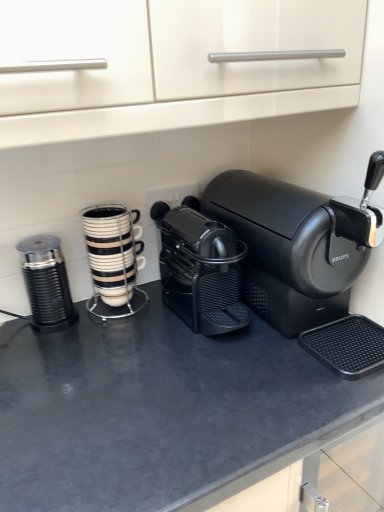
In order to face black matte coffee maker at center, the second coffee maker from the right, should I rotate leftwards or rightwards?

Rotate your view right by about 1.084°.

The image size is (384, 512). I want to click on white glossy cup stack at center, the first kitchen appliance positioned from the right, so click(113, 252).

Identify the location of metallic ribbed grinder at left, which is the first kitchen appliance from left to right. This screenshot has height=512, width=384. (47, 283).

The image size is (384, 512). I want to click on black matte counter top at center, so click(160, 412).

Between white glossy cup stack at center, the first kitchen appliance positioned from the right, and black matte counter top at center, which one has smaller size?

With smaller size is white glossy cup stack at center, the first kitchen appliance positioned from the right.

From a real-world perspective, between white glossy cup stack at center, which is the second kitchen appliance in left-to-right order, and black matte counter top at center, who is vertically lower?

black matte counter top at center is physically lower.

Considering the sizes of objects white glossy cup stack at center, the first kitchen appliance positioned from the right, and black matte counter top at center in the image provided, who is shorter, white glossy cup stack at center, the first kitchen appliance positioned from the right, or black matte counter top at center?

white glossy cup stack at center, the first kitchen appliance positioned from the right, is shorter.

Is white glossy cup stack at center, the first kitchen appliance positioned from the right, to the left of black matte counter top at center from the viewer's perspective?

Correct, you'll find white glossy cup stack at center, the first kitchen appliance positioned from the right, to the left of black matte counter top at center.

Consider the image. Can you see white glossy cup stack at center, which is the second kitchen appliance in left-to-right order, touching black matte coffee maker at center, which is the 2th coffee maker in left-to-right order?

No, white glossy cup stack at center, which is the second kitchen appliance in left-to-right order, is not beside black matte coffee maker at center, which is the 2th coffee maker in left-to-right order.

Is black matte coffee maker at center, which is the 2th coffee maker in left-to-right order, inside white glossy cup stack at center, which is the second kitchen appliance in left-to-right order?

No, black matte coffee maker at center, which is the 2th coffee maker in left-to-right order, is not surrounded by white glossy cup stack at center, which is the second kitchen appliance in left-to-right order.

Which is less distant, (x=138, y=264) or (x=265, y=243)?

Point (x=265, y=243)

Which object is thinner, white glossy cup stack at center, which is the second kitchen appliance in left-to-right order, or black matte coffee maker at center, which is the 2th coffee maker in left-to-right order?

With smaller width is white glossy cup stack at center, which is the second kitchen appliance in left-to-right order.

Looking at this image, is black matte coffee maker at center, the first coffee maker positioned from the left, smaller than white glossy cup stack at center, the first kitchen appliance positioned from the right?

Incorrect, black matte coffee maker at center, the first coffee maker positioned from the left, is not smaller in size than white glossy cup stack at center, the first kitchen appliance positioned from the right.

From a real-world perspective, is black matte coffee maker at center, the second coffee maker from the right, physically located above or below white glossy cup stack at center, which is the second kitchen appliance in left-to-right order?

black matte coffee maker at center, the second coffee maker from the right, is above white glossy cup stack at center, which is the second kitchen appliance in left-to-right order.

Considering the relative sizes of black matte coffee maker at center, the second coffee maker from the right, and white glossy cup stack at center, the first kitchen appliance positioned from the right, in the image provided, is black matte coffee maker at center, the second coffee maker from the right, wider than white glossy cup stack at center, the first kitchen appliance positioned from the right,?

Correct, the width of black matte coffee maker at center, the second coffee maker from the right, exceeds that of white glossy cup stack at center, the first kitchen appliance positioned from the right.

Is black matte coffee maker at center, the second coffee maker from the right, positioned far away from white glossy cup stack at center, which is the second kitchen appliance in left-to-right order?

No, black matte coffee maker at center, the second coffee maker from the right, is not far from white glossy cup stack at center, which is the second kitchen appliance in left-to-right order.

Consider the image. Is metallic ribbed grinder at left, marked as the second kitchen appliance in a right-to-left arrangement, positioned beyond the bounds of black matte coffee maker at center, which is the 1th coffee maker from right to left?

metallic ribbed grinder at left, marked as the second kitchen appliance in a right-to-left arrangement, is positioned outside black matte coffee maker at center, which is the 1th coffee maker from right to left.

Does point (73, 315) come farther from viewer compared to point (303, 287)?

Yes, point (73, 315) is farther from viewer.

Who is bigger, metallic ribbed grinder at left, which is the first kitchen appliance from left to right, or black matte coffee maker at center, which is the 1th coffee maker from right to left?

With larger size is black matte coffee maker at center, which is the 1th coffee maker from right to left.

Is metallic ribbed grinder at left, marked as the second kitchen appliance in a right-to-left arrangement, facing away from black matte coffee maker at center, which is the 2th coffee maker in left-to-right order?

No, black matte coffee maker at center, which is the 2th coffee maker in left-to-right order, is not at the back of metallic ribbed grinder at left, marked as the second kitchen appliance in a right-to-left arrangement.

Can you confirm if white glossy cup stack at center, which is the second kitchen appliance in left-to-right order, is wider than metallic ribbed grinder at left, which is the first kitchen appliance from left to right?

No.

From the image's perspective, between white glossy cup stack at center, which is the second kitchen appliance in left-to-right order, and metallic ribbed grinder at left, which is the first kitchen appliance from left to right, which one is located above?

white glossy cup stack at center, which is the second kitchen appliance in left-to-right order, is shown above in the image.

The height and width of the screenshot is (512, 384). Identify the location of kitchen appliance in front of the white glossy cup stack at center, the first kitchen appliance positioned from the right. (47, 283).

Considering the positions of points (96, 254) and (42, 305), is point (96, 254) closer to camera compared to point (42, 305)?

No.

From a real-world perspective, who is located higher, black matte counter top at center or white glossy cup stack at center, the first kitchen appliance positioned from the right?

In real-world perspective, white glossy cup stack at center, the first kitchen appliance positioned from the right, is above.

From the image's perspective, does black matte counter top at center appear higher than white glossy cup stack at center, the first kitchen appliance positioned from the right?

No, from the image's perspective, black matte counter top at center is not over white glossy cup stack at center, the first kitchen appliance positioned from the right.

This screenshot has width=384, height=512. I want to click on counter top below the white glossy cup stack at center, which is the second kitchen appliance in left-to-right order (from the image's perspective), so click(160, 412).

From their relative heights in the image, would you say black matte counter top at center is taller or shorter than white glossy cup stack at center, the first kitchen appliance positioned from the right?

In the image, black matte counter top at center appears to be taller than white glossy cup stack at center, the first kitchen appliance positioned from the right.

Is white glossy cup stack at center, the first kitchen appliance positioned from the right, positioned beyond the bounds of black matte coffee maker at center, the first coffee maker positioned from the left?

Yes, white glossy cup stack at center, the first kitchen appliance positioned from the right, is located beyond the bounds of black matte coffee maker at center, the first coffee maker positioned from the left.

Can you confirm if white glossy cup stack at center, the first kitchen appliance positioned from the right, is positioned to the right of black matte coffee maker at center, the second coffee maker from the right?

In fact, white glossy cup stack at center, the first kitchen appliance positioned from the right, is to the left of black matte coffee maker at center, the second coffee maker from the right.

The width and height of the screenshot is (384, 512). There is a black matte coffee maker at center, the first coffee maker positioned from the left. Find the location of `the 1st kitchen appliance below it (from a real-world perspective)`. the 1st kitchen appliance below it (from a real-world perspective) is located at coordinates (113, 252).

Locate an element on the screen. The image size is (384, 512). counter top that is on the right side of white glossy cup stack at center, the first kitchen appliance positioned from the right is located at coordinates (160, 412).

Which coffee maker is the 2nd one when counting from the front of the white glossy cup stack at center, which is the second kitchen appliance in left-to-right order? Please provide its 2D coordinates.

[(306, 261)]

From the image, which object appears to be farther from metallic ribbed grinder at left, which is the first kitchen appliance from left to right, white glossy cup stack at center, which is the second kitchen appliance in left-to-right order, or black matte coffee maker at center, which is the 1th coffee maker from right to left?

black matte coffee maker at center, which is the 1th coffee maker from right to left, is positioned further to the anchor metallic ribbed grinder at left, which is the first kitchen appliance from left to right.

Which object lies further to the anchor point metallic ribbed grinder at left, marked as the second kitchen appliance in a right-to-left arrangement, black matte coffee maker at center, which is the 2th coffee maker in left-to-right order, or black matte counter top at center?

black matte coffee maker at center, which is the 2th coffee maker in left-to-right order.

Looking at the image, which one is located further to metallic ribbed grinder at left, which is the first kitchen appliance from left to right, black matte coffee maker at center, the second coffee maker from the right, or black matte coffee maker at center, which is the 1th coffee maker from right to left?

black matte coffee maker at center, which is the 1th coffee maker from right to left, is positioned further to the anchor metallic ribbed grinder at left, which is the first kitchen appliance from left to right.

Estimate the real-world distances between objects in this image. Which object is closer to black matte coffee maker at center, which is the 2th coffee maker in left-to-right order, white glossy cup stack at center, the first kitchen appliance positioned from the right, or black matte counter top at center?

black matte counter top at center is closer to black matte coffee maker at center, which is the 2th coffee maker in left-to-right order.

Looking at the image, which one is located closer to black matte coffee maker at center, the second coffee maker from the right, black matte counter top at center or black matte coffee maker at center, which is the 2th coffee maker in left-to-right order?

Based on the image, black matte coffee maker at center, which is the 2th coffee maker in left-to-right order, appears to be nearer to black matte coffee maker at center, the second coffee maker from the right.

Estimate the real-world distances between objects in this image. Which object is closer to black matte coffee maker at center, the second coffee maker from the right, metallic ribbed grinder at left, marked as the second kitchen appliance in a right-to-left arrangement, or white glossy cup stack at center, which is the second kitchen appliance in left-to-right order?

Among the two, white glossy cup stack at center, which is the second kitchen appliance in left-to-right order, is located nearer to black matte coffee maker at center, the second coffee maker from the right.

Based on their spatial positions, is white glossy cup stack at center, which is the second kitchen appliance in left-to-right order, or black matte coffee maker at center, which is the 1th coffee maker from right to left, further from black matte counter top at center?

white glossy cup stack at center, which is the second kitchen appliance in left-to-right order, is positioned further to the anchor black matte counter top at center.

From the image, which object appears to be farther from black matte counter top at center, white glossy cup stack at center, which is the second kitchen appliance in left-to-right order, or metallic ribbed grinder at left, which is the first kitchen appliance from left to right?

white glossy cup stack at center, which is the second kitchen appliance in left-to-right order, is positioned further to the anchor black matte counter top at center.

Find the location of a particular element. This screenshot has width=384, height=512. kitchen appliance between white glossy cup stack at center, which is the second kitchen appliance in left-to-right order, and black matte counter top at center, in the vertical direction is located at coordinates (47, 283).

Find the location of a particular element. The height and width of the screenshot is (512, 384). kitchen appliance between metallic ribbed grinder at left, marked as the second kitchen appliance in a right-to-left arrangement, and black matte coffee maker at center, the second coffee maker from the right, in the horizontal direction is located at coordinates (113, 252).

Image resolution: width=384 pixels, height=512 pixels. I want to click on coffee maker situated between metallic ribbed grinder at left, marked as the second kitchen appliance in a right-to-left arrangement, and black matte coffee maker at center, which is the 1th coffee maker from right to left, from left to right, so click(200, 270).

Where is `kitchen appliance between metallic ribbed grinder at left, which is the first kitchen appliance from left to right, and black matte coffee maker at center, which is the 2th coffee maker in left-to-right order`? kitchen appliance between metallic ribbed grinder at left, which is the first kitchen appliance from left to right, and black matte coffee maker at center, which is the 2th coffee maker in left-to-right order is located at coordinates (113, 252).